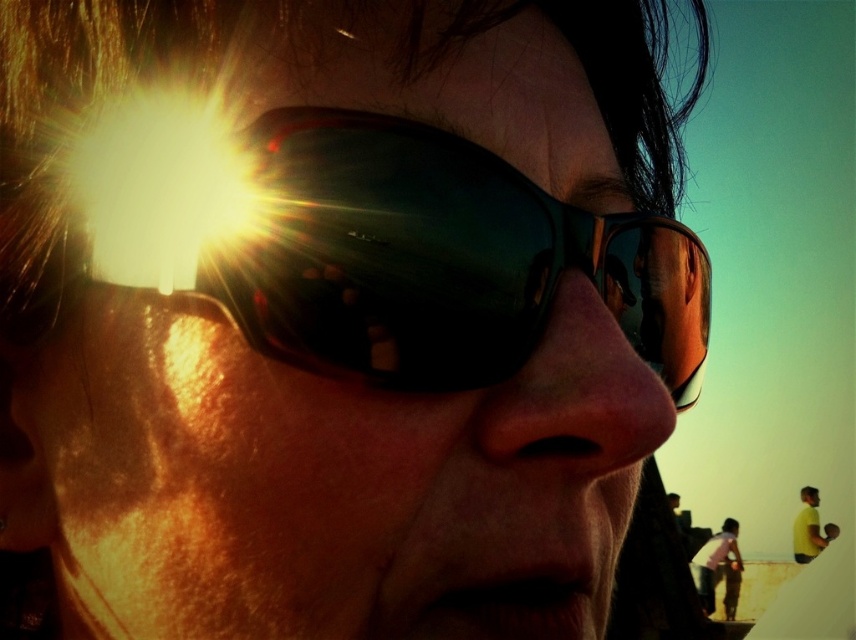
You are standing in front of the image and want to determine the distance between two points. The first point is at coordinates point (409, 332), and the second point is at coordinates point (813, 500). Which point is nearer to you?

Point (409, 332) is closer to the viewer than point (813, 500).

Based on the photo, you are a photographer trying to capture the reflection of the sun in the shiny black goggles at center and the yellow matte shirt at lower right. Which object will have a smaller reflection area in the photo?

The shiny black goggles at center occupies less space than yellow matte shirt at lower right, so the reflection area of the shiny black goggles at center will be smaller.